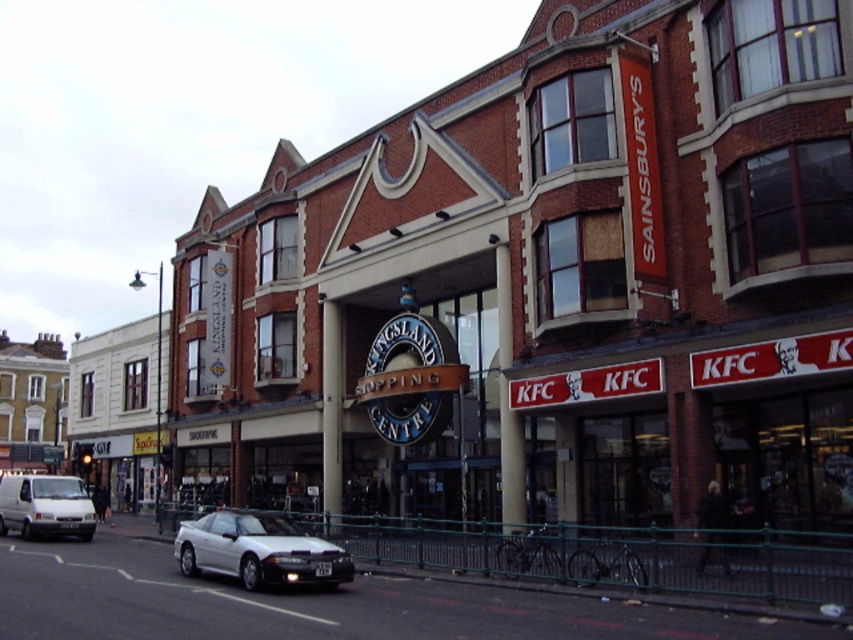
Can you confirm if white glossy car at lower left is shorter than white matte van at lower left?

Indeed, white glossy car at lower left has a lesser height compared to white matte van at lower left.

Is white glossy car at lower left to the right of white matte van at lower left from the viewer's perspective?

Correct, you'll find white glossy car at lower left to the right of white matte van at lower left.

Which is in front, point (190, 525) or point (28, 488)?

Positioned in front is point (190, 525).

This screenshot has width=853, height=640. Identify the location of white glossy car at lower left. (258, 550).